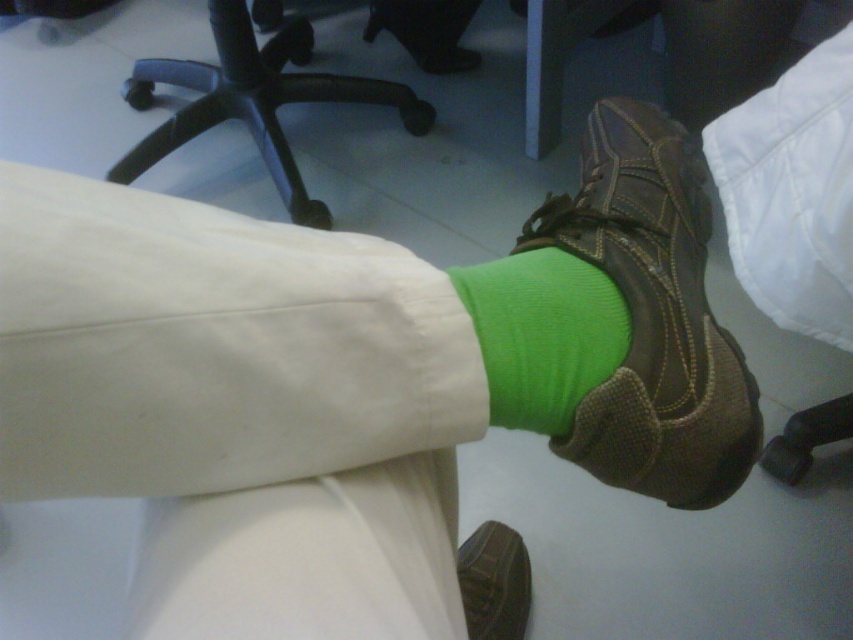
You are an interior designer analyzing the spatial layout of an office. You notice the green ribbed sock at center in the image. Based on its coordinates, can you determine if it is closer to the black office chair in the top left or the white table leg in the upper middle?

The green ribbed sock at center is located at coordinates point (543,333). Since the black office chair is in the top left corner and the white table leg is in the upper middle, the sock is closer to the white table leg in the upper middle based on its position in the center.

You are a shoe organizer trying to categorize items based on their height. You have a brown leather shoe at center and a green ribbed sock at center. Which item should you place in the taller section of your organizer?

The brown leather shoe at center is taller than the green ribbed sock at center, so it should be placed in the taller section of the organizer.

You are an office worker who needs to place a small sticker exactly at the center of the green ribbed sock in the image. Given that the coordinates of the sock are marked by point (543, 333), where should you place the sticker?

The sticker should be placed exactly at the coordinates (543, 333), which marks the center of the green ribbed sock.